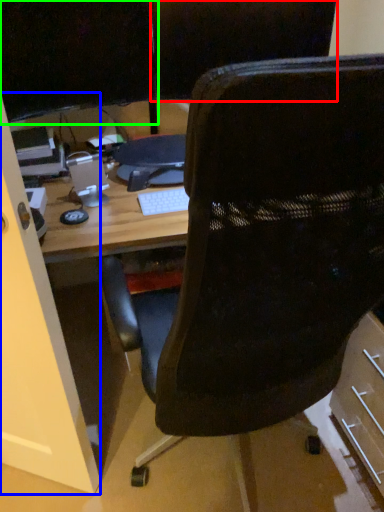
Question: Estimate the real-world distances between objects in this image. Which object is farther from back (highlighted by a red box), glass door (highlighted by a blue box) or computer monitor (highlighted by a green box)?

Choices:
 (A) glass door
 (B) computer monitor

Answer: (A)